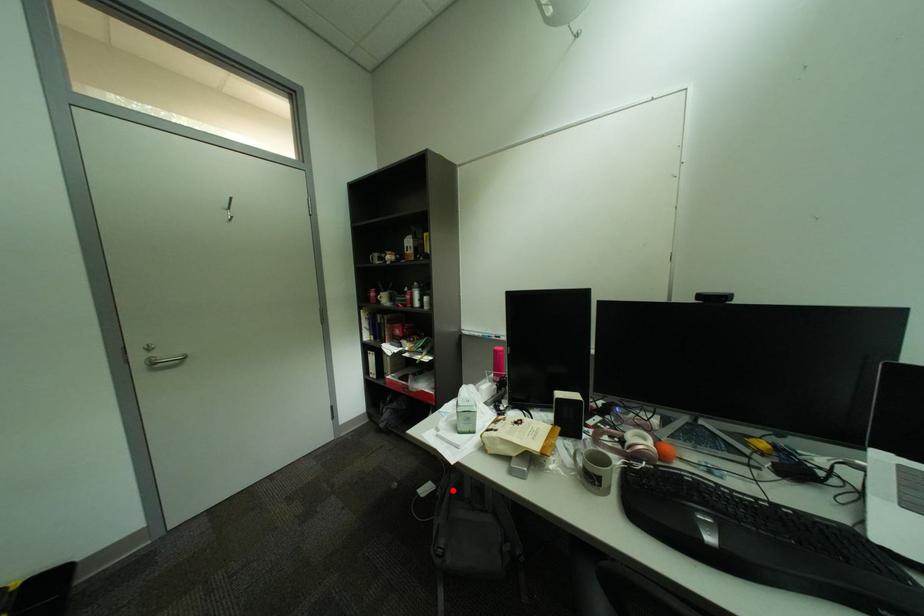
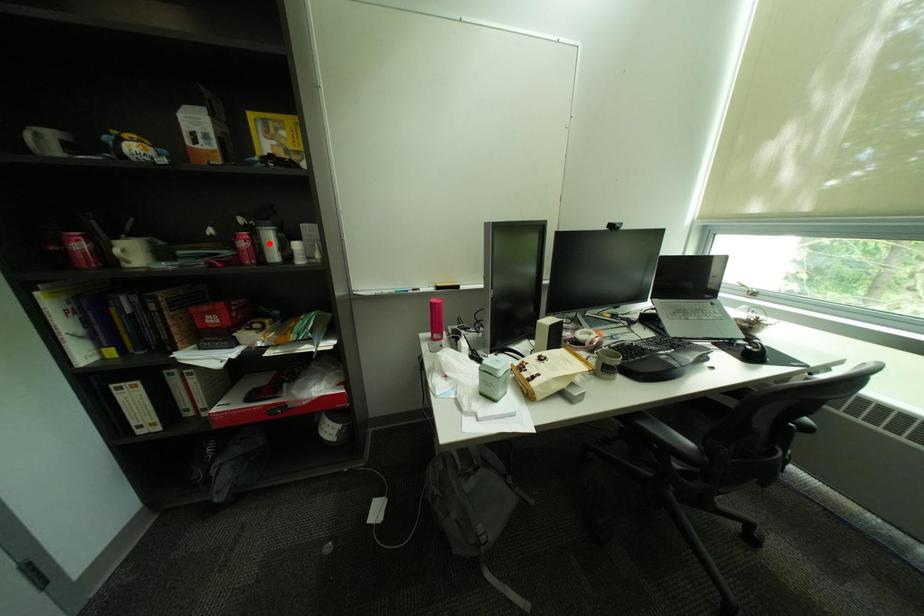
I am providing you with two images of the same scene from different viewpoints. A red point is marked on the first image and another point is marked on the second image. Is the red point in image1 aligned with the point shown in image2?

No